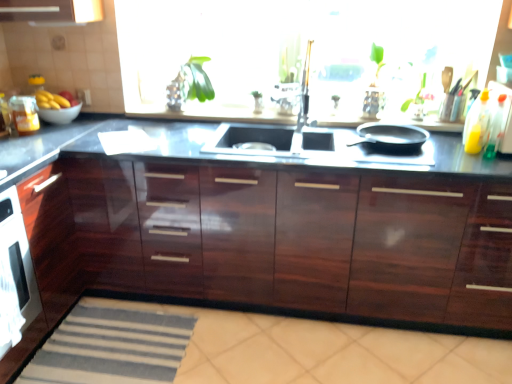
Locate an element on the screen. Image resolution: width=512 pixels, height=384 pixels. free location in front of translucent plastic bottle at right, which is counted as the 1th bottle, starting from the front is located at coordinates (495, 166).